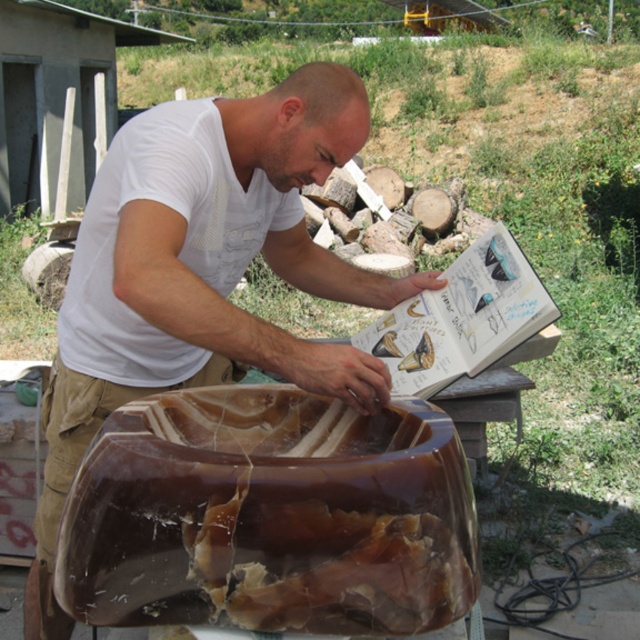
Is the position of translucent amber bowl at center less distant than that of brown leather belt at lower center?

Yes, it is.

Where is `translucent amber bowl at center`? This screenshot has height=640, width=640. translucent amber bowl at center is located at coordinates (269, 518).

Is point (420, 410) behind point (301, 125)?

No, (420, 410) is in front of (301, 125).

In the scene shown: Is translucent amber bowl at center behind white matte shirt at center?

That is False.

Measure the distance between point (177, 564) and camera.

The distance of point (177, 564) from camera is 1.17 meters.

Locate an element on the screen. The width and height of the screenshot is (640, 640). translucent amber bowl at center is located at coordinates point(269,518).

This screenshot has height=640, width=640. What do you see at coordinates (202, 273) in the screenshot? I see `white matte shirt at center` at bounding box center [202, 273].

Who is positioned more to the left, white matte shirt at center or brown leather belt at lower center?

brown leather belt at lower center

Locate an element on the screen. The height and width of the screenshot is (640, 640). white matte shirt at center is located at coordinates (202, 273).

Locate an element on the screen. This screenshot has height=640, width=640. white matte shirt at center is located at coordinates (202, 273).